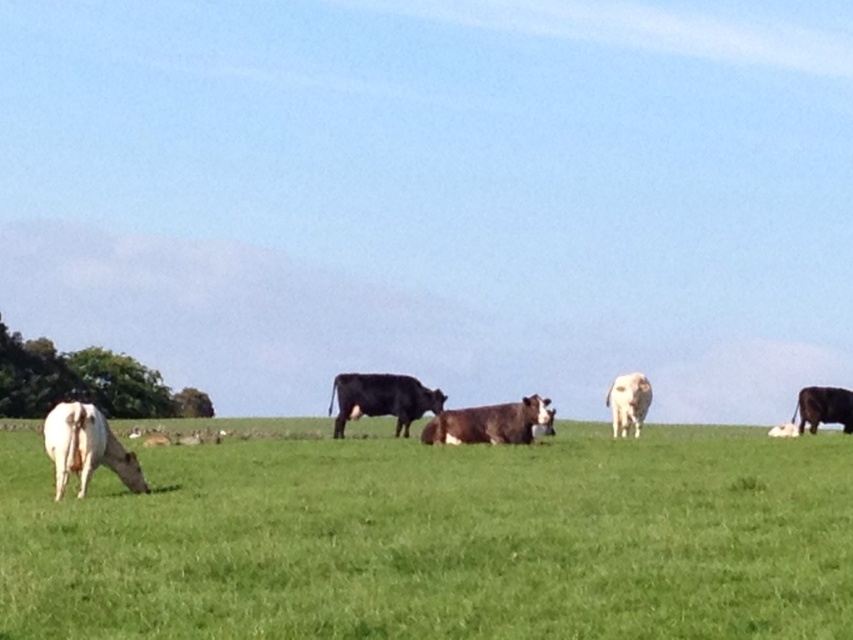
Question: Can you confirm if shiny black cow at center is positioned above brown smooth cow at center?

Choices:
 (A) yes
 (B) no

Answer: (B)

Question: In this image, where is white smooth cow at lower left located relative to shiny brown cow at right?

Choices:
 (A) right
 (B) left

Answer: (B)

Question: Which point appears closest to the camera in this image?

Choices:
 (A) (358, 410)
 (B) (198, 568)

Answer: (B)

Question: Which point is farther to the camera?

Choices:
 (A) brown smooth cow at center
 (B) shiny brown cow at right
 (C) white smooth cow at lower left
 (D) shiny black cow at center

Answer: (B)

Question: Observing the image, what is the correct spatial positioning of white smooth cow at lower left in reference to white smooth cow at left?

Choices:
 (A) left
 (B) right

Answer: (B)

Question: Which point is closer to the camera?

Choices:
 (A) (437, 419)
 (B) (387, 401)
 (C) (613, 419)
 (D) (801, 416)

Answer: (A)